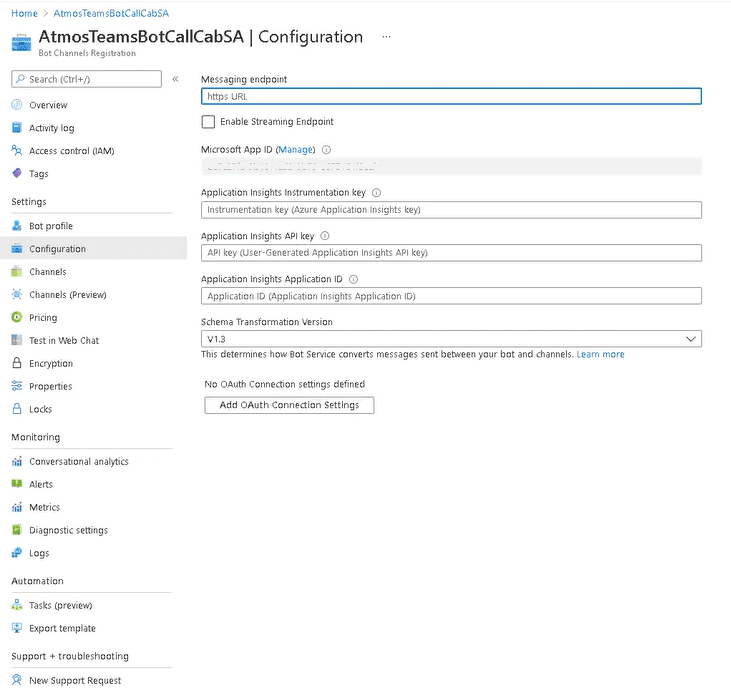
The width and height of the screenshot is (731, 692). I want to click on locks, so click(x=34, y=410).